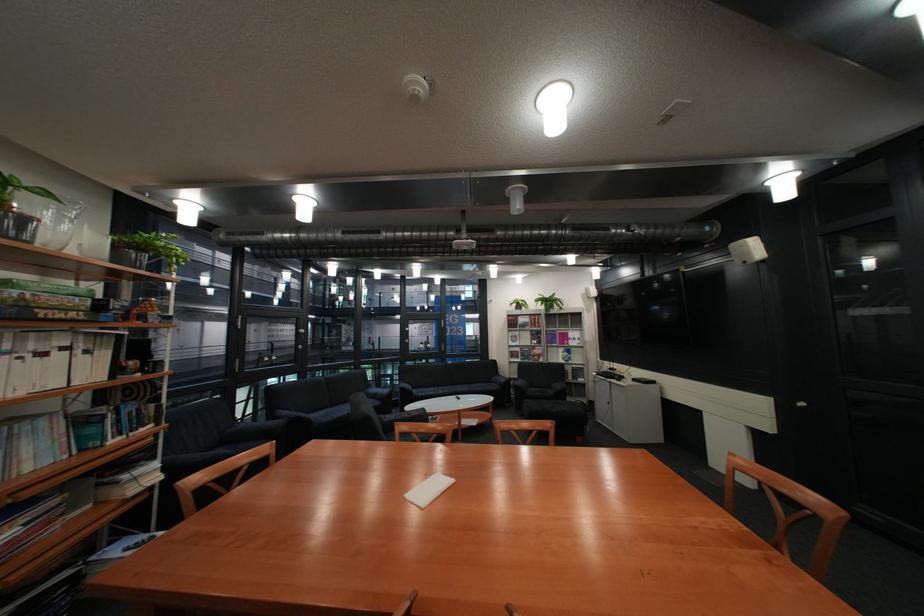
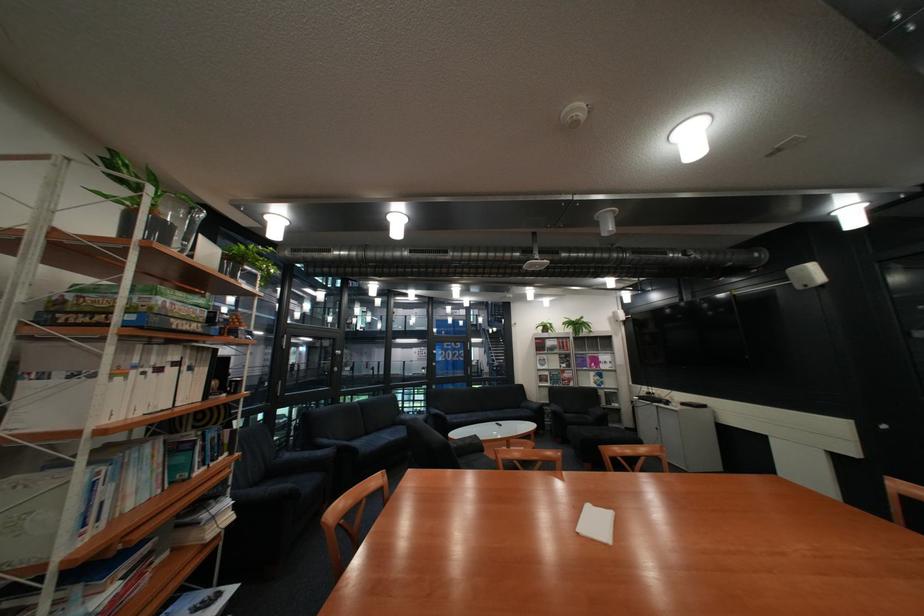
Question: Which direction would the cameraman need to move to produce the second image? Reply with the corresponding letter.

Choices:
 (A) Left
 (B) Right
 (C) Forward
 (D) Backward

Answer: (A)